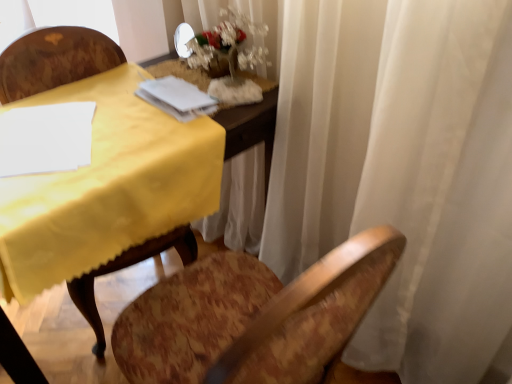
You are a GUI agent. You are given a task and a screenshot of the screen. Output one action in this format:
    pyautogui.click(x=<x>, y=<y>)
    Task: Click on the free point behind white paper at upper center
    
    Given the screenshot: What is the action you would take?
    pyautogui.click(x=152, y=70)